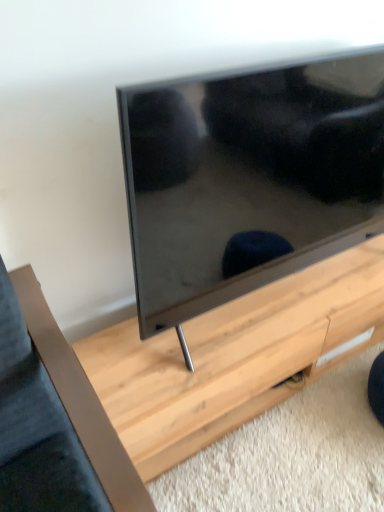
Identify the location of free region under matte black tv at center (from a real-world perspective). (284, 298).